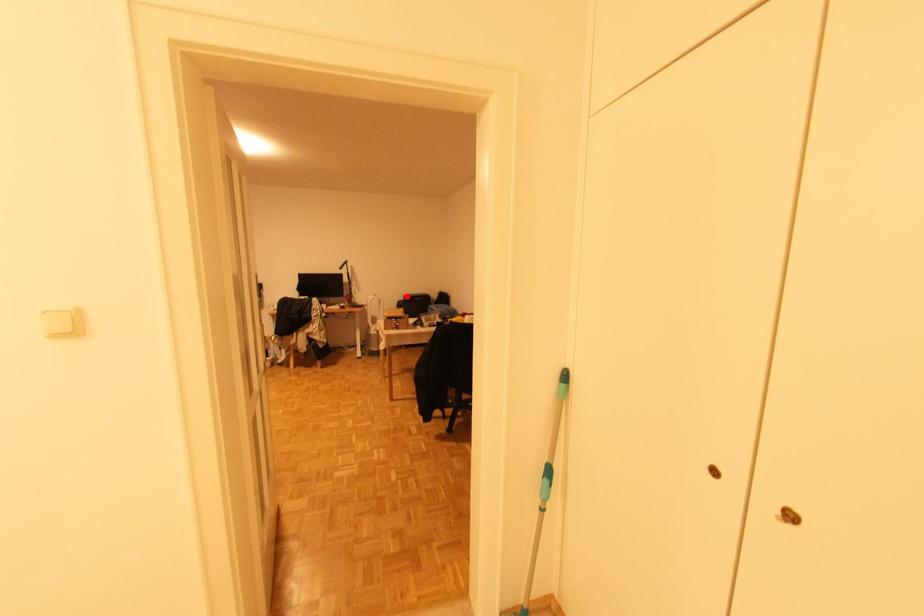
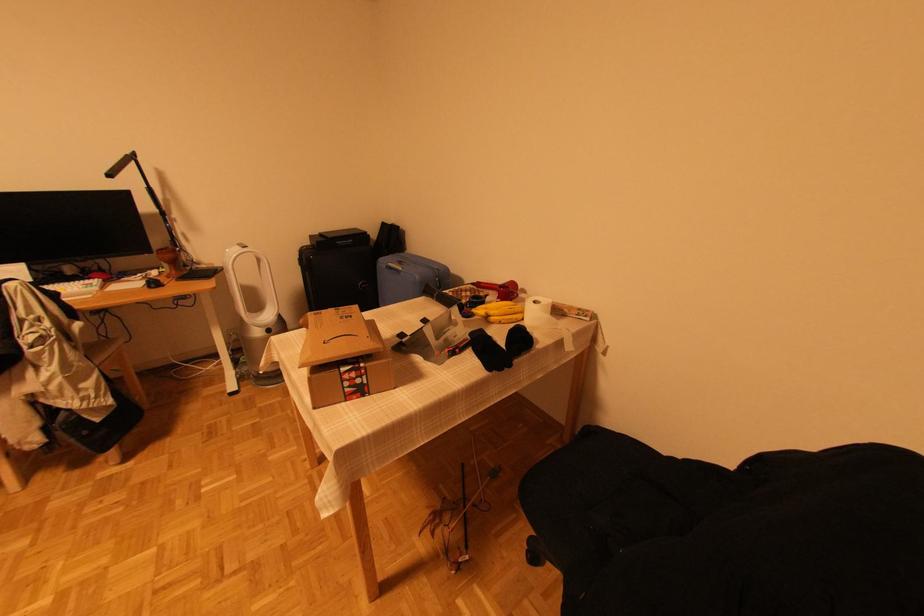
Where in the second image is the point corresponding to the highlighted location from the first image?

(314, 238)